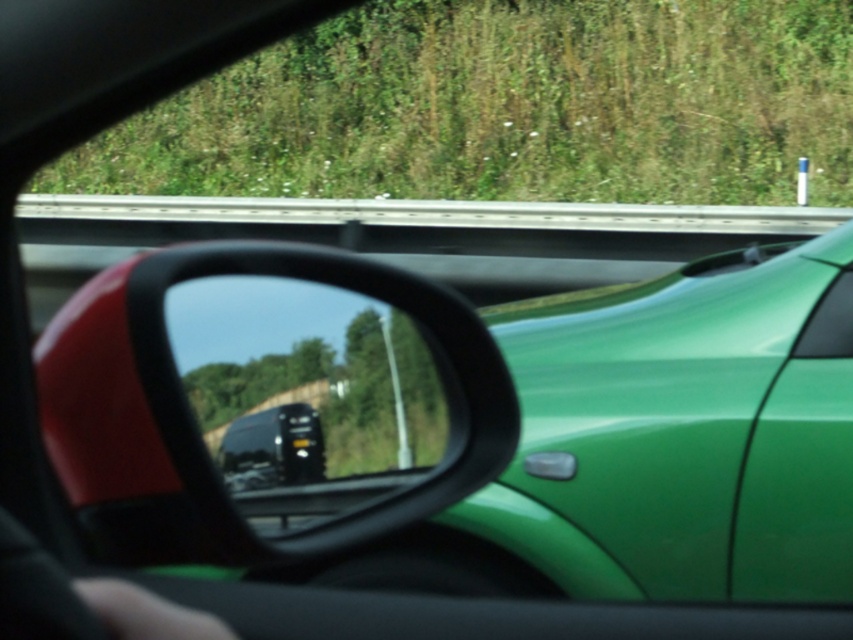
Question: Is black glossy mirror at center further to the viewer compared to green glossy car window at upper right?

Choices:
 (A) no
 (B) yes

Answer: (A)

Question: Can you confirm if black glossy mirror at center is positioned above green glossy car window at upper right?

Choices:
 (A) no
 (B) yes

Answer: (A)

Question: Considering the relative positions of black glossy mirror at center and green glossy car window at upper right in the image provided, where is black glossy mirror at center located with respect to green glossy car window at upper right?

Choices:
 (A) right
 (B) left

Answer: (B)

Question: Which point appears farthest from the camera in this image?

Choices:
 (A) (440, 384)
 (B) (831, 332)

Answer: (B)